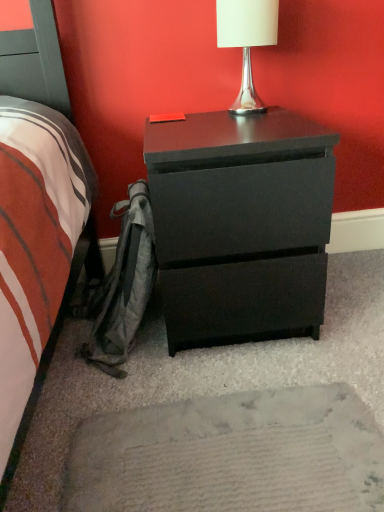
At what (x,y) coordinates should I click in order to perform the action: click on matte black chest of drawers at center. Please return your answer as a coordinate pair (x, y). The image size is (384, 512). Looking at the image, I should click on (240, 223).

In order to face matte black chest of drawers at center, should I rotate leftwards or rightwards?

To align with it, rotate right about 4.994°.

The image size is (384, 512). What do you see at coordinates (240, 223) in the screenshot? I see `matte black chest of drawers at center` at bounding box center [240, 223].

The image size is (384, 512). What do you see at coordinates (247, 41) in the screenshot? I see `white glossy table lamp at upper center` at bounding box center [247, 41].

Measure the distance between white glossy table lamp at upper center and camera.

white glossy table lamp at upper center and camera are 1.03 meters apart.

In order to face white glossy table lamp at upper center, should I rotate leftwards or rightwards?

Turn right approximately 7.668 degrees to face it.

At what (x,y) coordinates should I click in order to perform the action: click on white glossy table lamp at upper center. Please return your answer as a coordinate pair (x, y). Looking at the image, I should click on (247, 41).

Looking at this image, what is the approximate height of white glossy table lamp at upper center?

11.28 inches.

You are a GUI agent. You are given a task and a screenshot of the screen. Output one action in this format:
    pyautogui.click(x=<x>, y=<y>)
    Task: Click on the matte black chest of drawers at center
    
    Given the screenshot: What is the action you would take?
    pyautogui.click(x=240, y=223)

Which object is positioned more to the right, white glossy table lamp at upper center or matte black chest of drawers at center?

From the viewer's perspective, white glossy table lamp at upper center appears more on the right side.

Is white glossy table lamp at upper center in front of or behind matte black chest of drawers at center in the image?

white glossy table lamp at upper center is positioned farther from the viewer than matte black chest of drawers at center.

Is point (272, 17) closer or farther from the camera than point (232, 271)?

Point (272, 17) is positioned farther from the camera compared to point (232, 271).

From the image's perspective, which one is positioned higher, white glossy table lamp at upper center or matte black chest of drawers at center?

From the image's view, white glossy table lamp at upper center is above.

From a real-world perspective, which is physically above, white glossy table lamp at upper center or matte black chest of drawers at center?

In real-world perspective, white glossy table lamp at upper center is above.

Considering the relative sizes of white glossy table lamp at upper center and matte black chest of drawers at center in the image provided, is white glossy table lamp at upper center thinner than matte black chest of drawers at center?

Indeed, white glossy table lamp at upper center has a lesser width compared to matte black chest of drawers at center.

In the scene shown: Which of these two, white glossy table lamp at upper center or matte black chest of drawers at center, stands shorter?

white glossy table lamp at upper center.

Is white glossy table lamp at upper center bigger than matte black chest of drawers at center?

Actually, white glossy table lamp at upper center might be smaller than matte black chest of drawers at center.

Is white glossy table lamp at upper center not inside matte black chest of drawers at center?

Absolutely, white glossy table lamp at upper center is external to matte black chest of drawers at center.

Is white glossy table lamp at upper center placed right next to matte black chest of drawers at center?

No, white glossy table lamp at upper center is not making contact with matte black chest of drawers at center.

Is white glossy table lamp at upper center facing towards matte black chest of drawers at center?

No, white glossy table lamp at upper center is not oriented towards matte black chest of drawers at center.

Can you tell me how much white glossy table lamp at upper center and matte black chest of drawers at center differ in facing direction?

0.000672 degrees separate the facing orientations of white glossy table lamp at upper center and matte black chest of drawers at center.

In order to click on table lamp located above the matte black chest of drawers at center (from a real-world perspective) in this screenshot , I will do `click(247, 41)`.

Considering the positions of objects matte black chest of drawers at center and white glossy table lamp at upper center in the image provided, who is more to the right, matte black chest of drawers at center or white glossy table lamp at upper center?

white glossy table lamp at upper center.

Is matte black chest of drawers at center positioned before white glossy table lamp at upper center?

Yes, it is.

Which point is more distant from viewer, [202,177] or [227,29]?

Positioned behind is point [227,29].

From the image's perspective, is matte black chest of drawers at center on white glossy table lamp at upper center?

Incorrect, from the image's perspective, matte black chest of drawers at center is lower than white glossy table lamp at upper center.

From a real-world perspective, between matte black chest of drawers at center and white glossy table lamp at upper center, who is vertically lower?

In real-world perspective, matte black chest of drawers at center is lower.

Considering the sizes of objects matte black chest of drawers at center and white glossy table lamp at upper center in the image provided, who is wider, matte black chest of drawers at center or white glossy table lamp at upper center?

matte black chest of drawers at center.

Considering the sizes of matte black chest of drawers at center and white glossy table lamp at upper center in the image, is matte black chest of drawers at center taller or shorter than white glossy table lamp at upper center?

matte black chest of drawers at center is taller than white glossy table lamp at upper center.

Considering the relative sizes of matte black chest of drawers at center and white glossy table lamp at upper center in the image provided, is matte black chest of drawers at center smaller than white glossy table lamp at upper center?

Actually, matte black chest of drawers at center might be larger than white glossy table lamp at upper center.

Does matte black chest of drawers at center contain white glossy table lamp at upper center?

No.

Is matte black chest of drawers at center touching white glossy table lamp at upper center?

No, matte black chest of drawers at center is not beside white glossy table lamp at upper center.

From the picture: Is matte black chest of drawers at center aimed at white glossy table lamp at upper center?

No, matte black chest of drawers at center is not facing towards white glossy table lamp at upper center.

How many degrees apart are the facing directions of matte black chest of drawers at center and white glossy table lamp at upper center?

The facing directions of matte black chest of drawers at center and white glossy table lamp at upper center are 0.000672 degrees apart.

You are a GUI agent. You are given a task and a screenshot of the screen. Output one action in this format:
    pyautogui.click(x=<x>, y=<y>)
    Task: Click on the table lamp located on the right of matte black chest of drawers at center
    This screenshot has width=384, height=512.
    Given the screenshot: What is the action you would take?
    pyautogui.click(x=247, y=41)

In the image, there is a matte black chest of drawers at center. Identify the location of table lamp above it (from the image's perspective). Image resolution: width=384 pixels, height=512 pixels. (247, 41).

You are a GUI agent. You are given a task and a screenshot of the screen. Output one action in this format:
    pyautogui.click(x=<x>, y=<y>)
    Task: Click on the chest of drawers in front of the white glossy table lamp at upper center
    
    Given the screenshot: What is the action you would take?
    pyautogui.click(x=240, y=223)